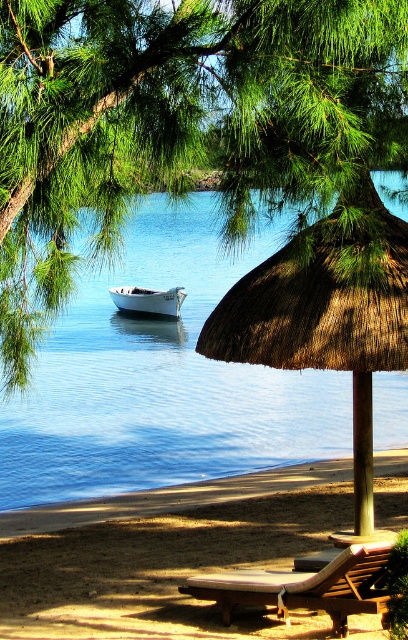
You are a photographer standing at the beach and want to capture both the green leafy tree at upper left and the wooden textured lounge chair at lower center in your photo. Which object will appear larger in your photo?

The green leafy tree at upper left will appear larger in the photo because it is closer to the viewer than the wooden textured lounge chair at lower center.

You are standing at the beach and want to walk from point A to point B. Point A is located at coordinates point [82,412] and point B is at point [124,305]. According to the scene description, which direction should you face to move from point A to point B?

Since point [82,412] is in front of point [124,305], you should face backward to move from point A to point B.

You are standing at the center of the beach scene. There is a point located at coordinate [179,124]. Which object from the scene does this point belong to?

The point at coordinate [179,124] belongs to the green leafy tree at upper left.